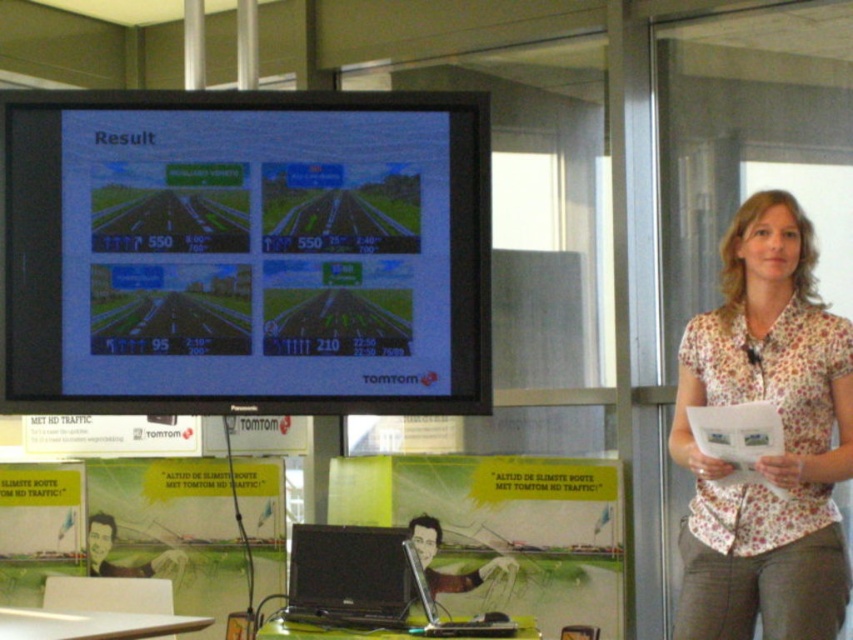
Question: Can you confirm if white floral shirt at upper right is positioned to the right of black glossy laptop at center?

Choices:
 (A) no
 (B) yes

Answer: (B)

Question: Which of the following is the farthest from the observer?

Choices:
 (A) click(x=785, y=621)
 (B) click(x=408, y=593)
 (C) click(x=178, y=376)

Answer: (C)

Question: Which object is positioned farthest from the white floral shirt at upper right?

Choices:
 (A) matte black monitor at upper left
 (B) black glossy laptop at center
 (C) black glossy laptop at lower center

Answer: (A)

Question: Can you confirm if white floral shirt at upper right is thinner than black glossy laptop at lower center?

Choices:
 (A) no
 (B) yes

Answer: (A)

Question: Is white floral shirt at upper right wider than black glossy laptop at lower center?

Choices:
 (A) yes
 (B) no

Answer: (A)

Question: Among these points, which one is nearest to the camera?

Choices:
 (A) (96, 340)
 (B) (299, 561)

Answer: (B)